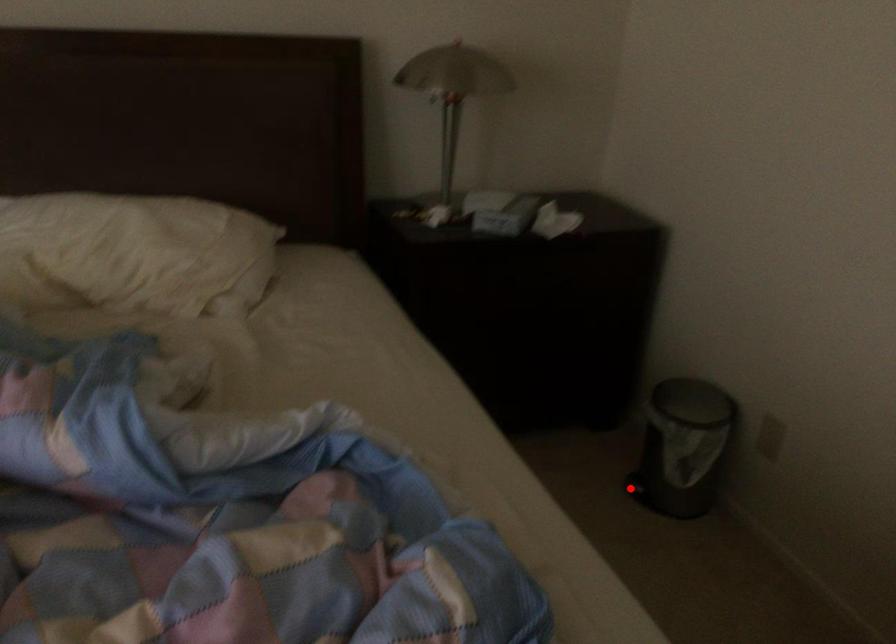
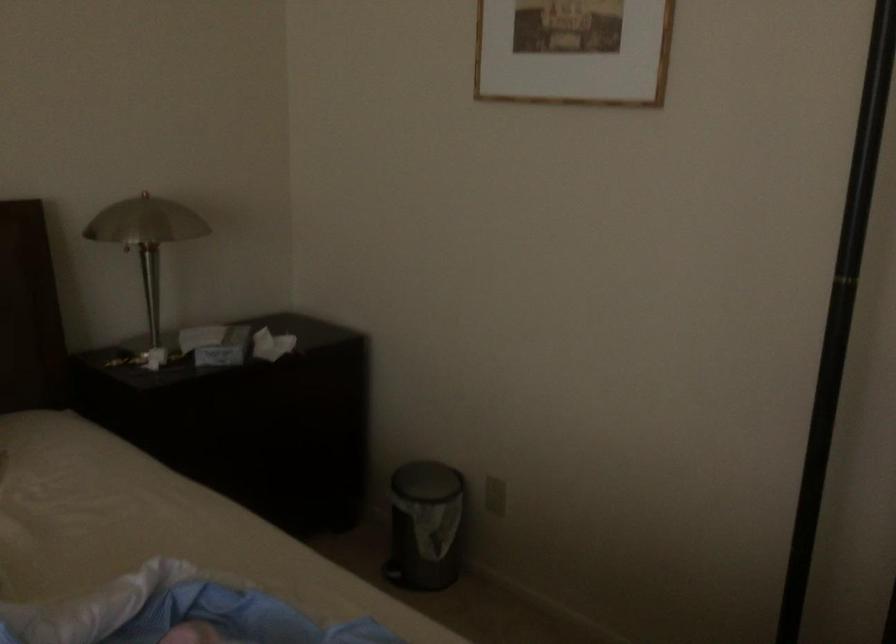
Find the pixel in the second image that matches the highlighted location in the first image.

(392, 573)